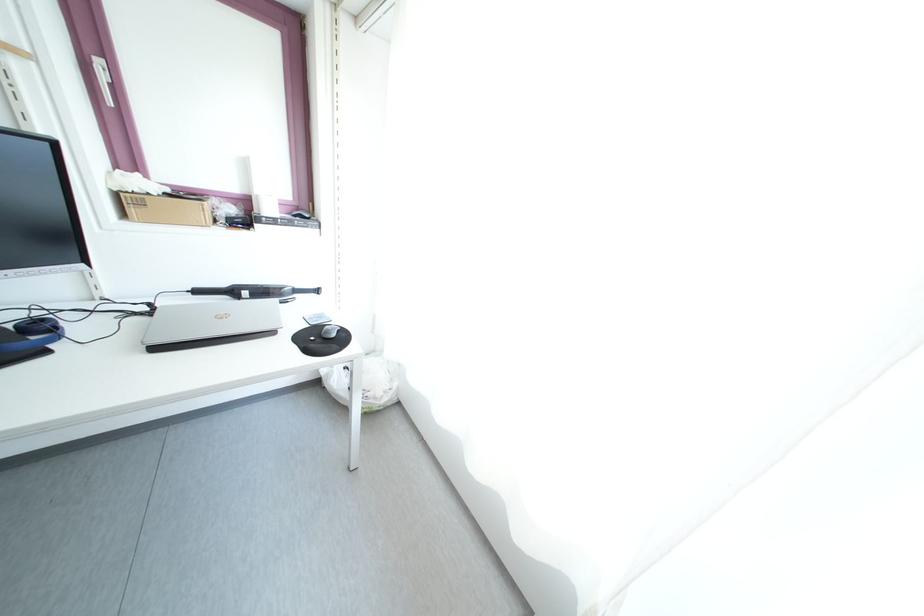
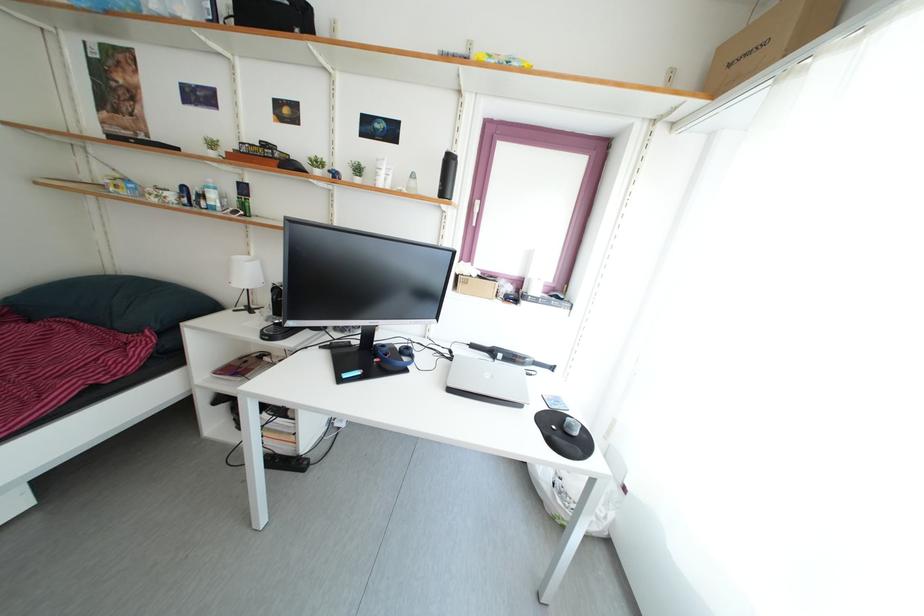
Question: The images are taken continuously from a first-person perspective. In which direction is your viewpoint rotating?

Choices:
 (A) Left
 (B) Right
 (C) Up
 (D) Down

Answer: (A)